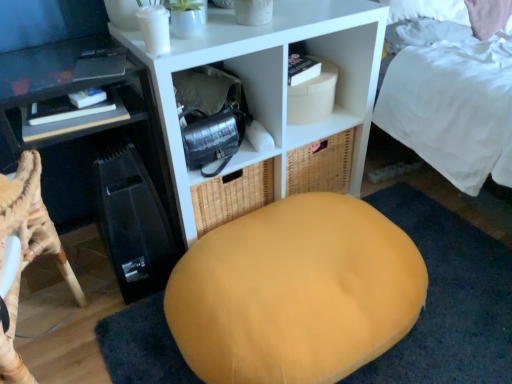
Image resolution: width=512 pixels, height=384 pixels. What are the coordinates of `free space underneath matte black desk at left (from a real-world perspective)` in the screenshot? It's located at (66, 354).